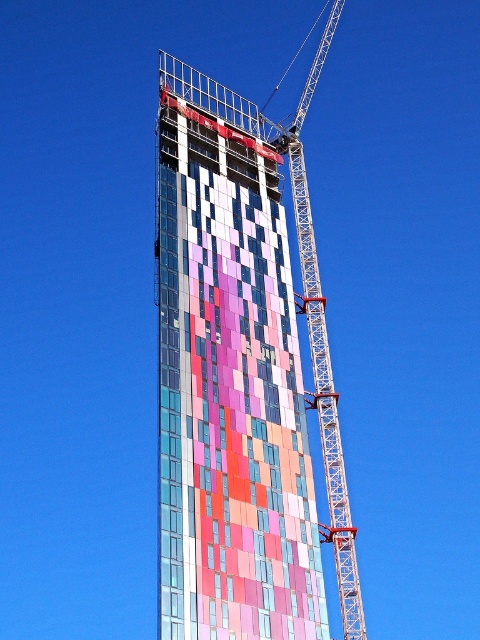
You are an architect observing the construction site. You need to determine the best angle to photograph the multicolored glass facade at center without the metallic lattice crane at center obstructing the view. Based on their positions, can you suggest a direction to move to ensure the crane is out of frame?

The multicolored glass facade at center is closer to the viewer than the metallic lattice crane at center. To avoid the crane obstructing the view, move towards the direction where the crane is farther away, such as to the left or behind the facade.

You are an architect observing the construction site. You need to determine if the multicolored glass facade at center can be fully visible from the ground without obstruction from the metallic lattice crane at center. Based on their heights, can the facade be seen clearly?

The multicolored glass facade at center is shorter than the metallic lattice crane at center, so the crane may obstruct the view of the facade from the ground.

You are a construction worker standing at the base of the multicolored glass facade at center. You need to move a heavy beam to the metallic lattice crane at center. The beam is 10 meters long. Can you safely move it without it hitting the facade or the crane?

The distance between the multicolored glass facade at center and the metallic lattice crane at center is 9.36 meters. Since the beam is 10 meters long, it is longer than the available space. Therefore, moving it horizontally would risk collision with either the facade or the crane. A safer approach would be to tilt the beam vertically or find a path with sufficient clearance.